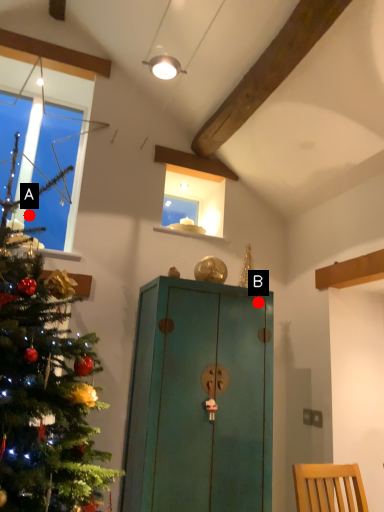
Question: Two points are circled on the image, labeled by A and B beside each circle. Which point is further to the camera?

Choices:
 (A) A is further
 (B) B is further

Answer: (B)